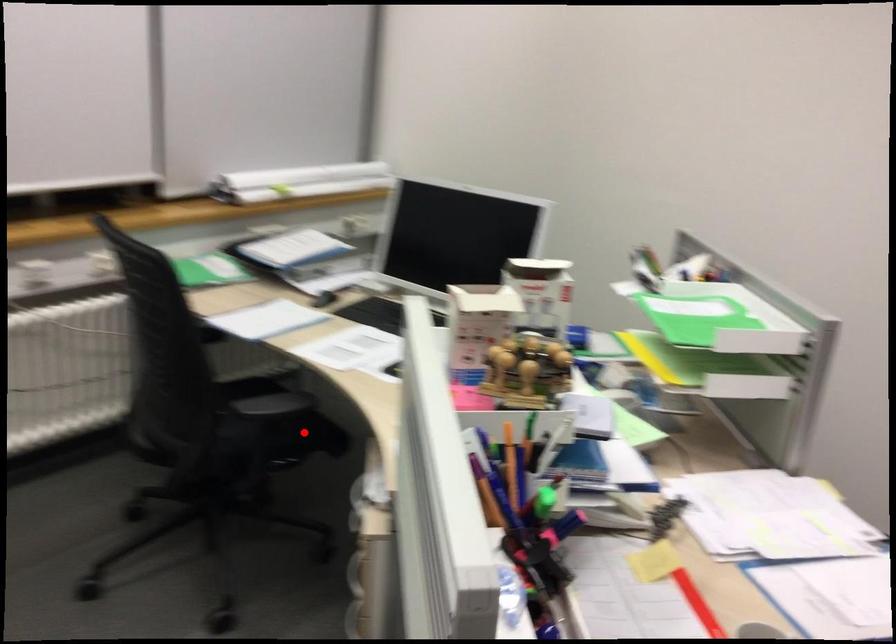
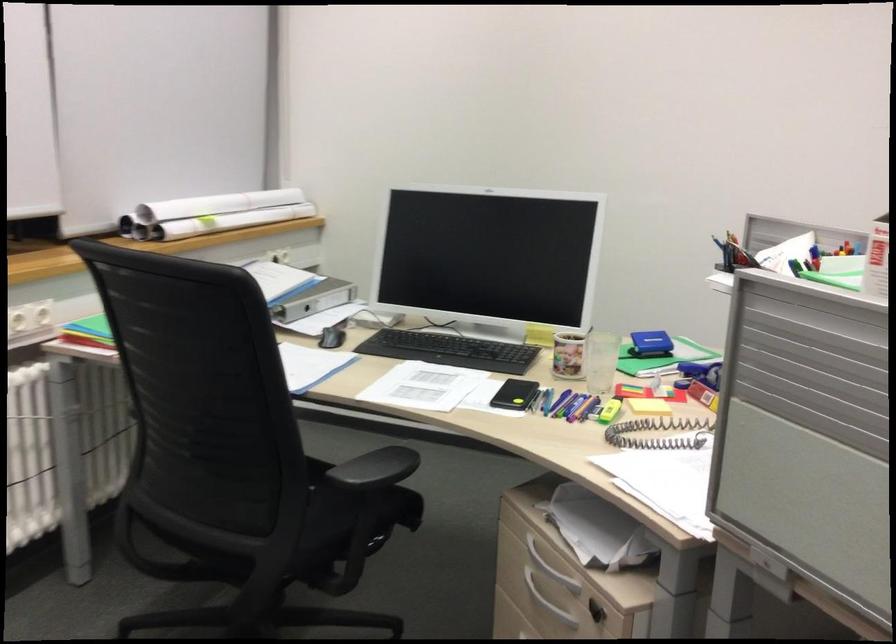
Question: I am providing you with two images of the same scene from different viewpoints. A red point is shown in image1. For the corresponding object point in image2, is it positioned nearer or farther from the camera?

Choices:
 (A) Nearer
 (B) Farther

Answer: (A)